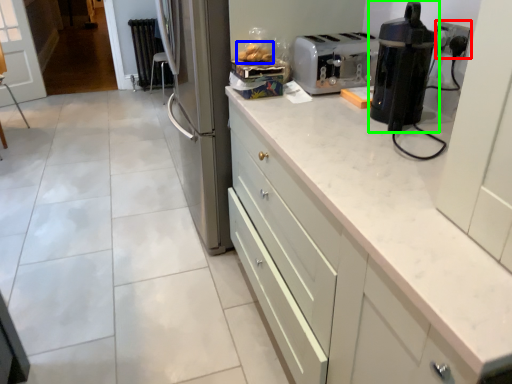
Question: Considering the real-world distances, which object is closest to electric outlet (highlighted by a red box)? food (highlighted by a blue box) or home appliance (highlighted by a green box).

Choices:
 (A) food
 (B) home appliance

Answer: (B)